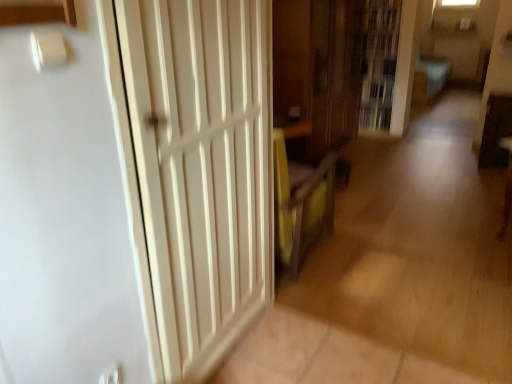
Question: From a real-world perspective, is white wood door at left positioned above or below wooden bookcase at upper right?

Choices:
 (A) below
 (B) above

Answer: (A)

Question: Is white wood door at left to the left or to the right of wooden bookcase at upper right in the image?

Choices:
 (A) left
 (B) right

Answer: (A)

Question: Which object is positioned farthest from the hardcover book at center, the 2th book positioned from the top?

Choices:
 (A) hardcover book at center, marked as the 2th book in a bottom-to-top arrangement
 (B) white wood door at left
 (C) wooden cabinet at center
 (D) wooden bookcase at upper right

Answer: (B)

Question: Estimate the real-world distances between objects in this image. Which object is closer to the wooden bookcase at upper right?

Choices:
 (A) wooden cabinet at center
 (B) white wood door at left
 (C) hardcover book at center, the 2th book positioned from the top
 (D) hardcover book at center, the first book viewed from the top

Answer: (D)